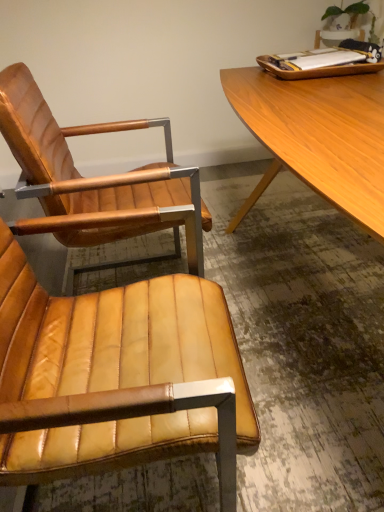
The height and width of the screenshot is (512, 384). Describe the element at coordinates (95, 179) in the screenshot. I see `leather chair at center, the first chair from the back` at that location.

The height and width of the screenshot is (512, 384). Identify the location of leather chair at center, the first chair from the back. (95, 179).

In order to face leather chair at center, the first chair from the back, should I rotate leftwards or rightwards?

To align with it, rotate left about 9.869°.

The height and width of the screenshot is (512, 384). Describe the element at coordinates (114, 376) in the screenshot. I see `leather chair at center, which appears as the second chair when viewed from the back` at that location.

The height and width of the screenshot is (512, 384). Identify the location of leather chair at center, which ranks as the first chair in front-to-back order. (114, 376).

Based on the photo, in order to face leather chair at center, which ranks as the first chair in front-to-back order, should I rotate leftwards or rightwards?

Turn left approximately 12.719 degrees to face it.

Image resolution: width=384 pixels, height=512 pixels. I want to click on leather chair at center, the first chair from the back, so click(95, 179).

Between leather chair at center, the first chair from the back, and leather chair at center, which appears as the second chair when viewed from the back, which one appears on the right side from the viewer's perspective?

leather chair at center, which appears as the second chair when viewed from the back.

Based on the photo, is the position of leather chair at center, the first chair from the back, less distant than that of leather chair at center, which ranks as the first chair in front-to-back order?

No, it is not.

Considering the positions of point (53, 134) and point (157, 412), is point (53, 134) closer or farther from the camera than point (157, 412)?

Point (53, 134) is farther from the camera than point (157, 412).

From the image's perspective, is leather chair at center, the first chair from the back, beneath leather chair at center, which ranks as the first chair in front-to-back order?

Actually, leather chair at center, the first chair from the back, appears above leather chair at center, which ranks as the first chair in front-to-back order, in the image.

Looking at this image, from a real-world perspective, between leather chair at center, the first chair from the back, and leather chair at center, which appears as the second chair when viewed from the back, who is vertically lower?

leather chair at center, which appears as the second chair when viewed from the back.

Considering the sizes of objects leather chair at center, the first chair from the back, and leather chair at center, which appears as the second chair when viewed from the back, in the image provided, who is wider, leather chair at center, the first chair from the back, or leather chair at center, which appears as the second chair when viewed from the back,?

With larger width is leather chair at center, the first chair from the back.

Considering the relative sizes of leather chair at center, which appears as the second chair when viewed from the front, and leather chair at center, which ranks as the first chair in front-to-back order, in the image provided, is leather chair at center, which appears as the second chair when viewed from the front, taller than leather chair at center, which ranks as the first chair in front-to-back order,?

Yes, leather chair at center, which appears as the second chair when viewed from the front, is taller than leather chair at center, which ranks as the first chair in front-to-back order.

Based on their sizes in the image, would you say leather chair at center, which appears as the second chair when viewed from the front, is bigger or smaller than leather chair at center, which ranks as the first chair in front-to-back order?

leather chair at center, which appears as the second chair when viewed from the front, is bigger than leather chair at center, which ranks as the first chair in front-to-back order.

Is leather chair at center, which appears as the second chair when viewed from the front, not within leather chair at center, which appears as the second chair when viewed from the back?

Indeed, leather chair at center, which appears as the second chair when viewed from the front, is completely outside leather chair at center, which appears as the second chair when viewed from the back.

Are leather chair at center, which appears as the second chair when viewed from the front, and leather chair at center, which appears as the second chair when viewed from the back, far apart?

No, there isn't a large distance between leather chair at center, which appears as the second chair when viewed from the front, and leather chair at center, which appears as the second chair when viewed from the back.

Is leather chair at center, which appears as the second chair when viewed from the front, looking in the opposite direction of leather chair at center, which ranks as the first chair in front-to-back order?

leather chair at center, which appears as the second chair when viewed from the front, does not have its back to leather chair at center, which ranks as the first chair in front-to-back order.

How many degrees apart are the facing directions of leather chair at center, the first chair from the back, and leather chair at center, which ranks as the first chair in front-to-back order?

The angular difference between leather chair at center, the first chair from the back, and leather chair at center, which ranks as the first chair in front-to-back order, is 4.02 degrees.

Where is `chair behind the leather chair at center, which appears as the second chair when viewed from the back`? chair behind the leather chair at center, which appears as the second chair when viewed from the back is located at coordinates (95, 179).

Can you confirm if leather chair at center, which appears as the second chair when viewed from the back, is positioned to the left of leather chair at center, which appears as the second chair when viewed from the front?

Incorrect, leather chair at center, which appears as the second chair when viewed from the back, is not on the left side of leather chair at center, which appears as the second chair when viewed from the front.

Is leather chair at center, which appears as the second chair when viewed from the back, positioned before leather chair at center, the first chair from the back?

Yes, it is.

Is point (233, 374) behind point (179, 242)?

That is False.

Based on the photo, from the image's perspective, which object appears higher, leather chair at center, which ranks as the first chair in front-to-back order, or leather chair at center, the first chair from the back?

From the image's view, leather chair at center, the first chair from the back, is above.

From a real-world perspective, is leather chair at center, which appears as the second chair when viewed from the back, physically below leather chair at center, which appears as the second chair when viewed from the front?

Yes.

Considering the sizes of objects leather chair at center, which appears as the second chair when viewed from the back, and leather chair at center, which appears as the second chair when viewed from the front, in the image provided, who is wider, leather chair at center, which appears as the second chair when viewed from the back, or leather chair at center, which appears as the second chair when viewed from the front,?

With larger width is leather chair at center, which appears as the second chair when viewed from the front.

Is leather chair at center, which ranks as the first chair in front-to-back order, taller or shorter than leather chair at center, the first chair from the back?

Considering their sizes, leather chair at center, which ranks as the first chair in front-to-back order, has less height than leather chair at center, the first chair from the back.

In terms of size, does leather chair at center, which ranks as the first chair in front-to-back order, appear bigger or smaller than leather chair at center, the first chair from the back?

Clearly, leather chair at center, which ranks as the first chair in front-to-back order, is smaller in size than leather chair at center, the first chair from the back.

Choose the correct answer: Is leather chair at center, which ranks as the first chair in front-to-back order, inside leather chair at center, which appears as the second chair when viewed from the front, or outside it?

leather chair at center, which ranks as the first chair in front-to-back order, is not inside leather chair at center, which appears as the second chair when viewed from the front, it's outside.

Are leather chair at center, which ranks as the first chair in front-to-back order, and leather chair at center, which appears as the second chair when viewed from the front, beside each other?

There is a gap between leather chair at center, which ranks as the first chair in front-to-back order, and leather chair at center, which appears as the second chair when viewed from the front.

Is leather chair at center, which ranks as the first chair in front-to-back order, looking in the opposite direction of leather chair at center, which appears as the second chair when viewed from the front?

No, leather chair at center, which ranks as the first chair in front-to-back order, is not facing the opposite direction of leather chair at center, which appears as the second chair when viewed from the front.

At what (x,y) coordinates should I click in order to perform the action: click on chair above the leather chair at center, which ranks as the first chair in front-to-back order (from a real-world perspective). Please return your answer as a coordinate pair (x, y). The width and height of the screenshot is (384, 512). Looking at the image, I should click on tap(95, 179).

Where is `chair located underneath the leather chair at center, which appears as the second chair when viewed from the front (from a real-world perspective)`? The image size is (384, 512). chair located underneath the leather chair at center, which appears as the second chair when viewed from the front (from a real-world perspective) is located at coordinates (114, 376).

The width and height of the screenshot is (384, 512). In order to click on chair on the left of leather chair at center, which appears as the second chair when viewed from the back in this screenshot , I will do `click(95, 179)`.